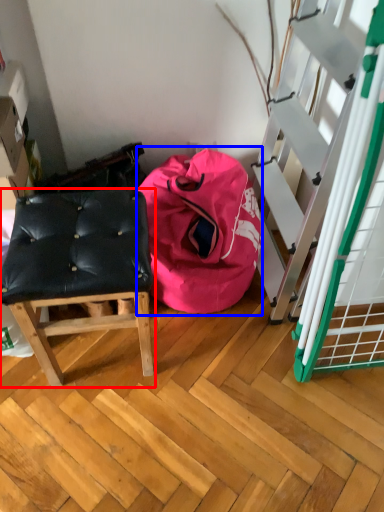
Question: Which object is further to the camera taking this photo, furniture (highlighted by a red box) or bean bag chair (highlighted by a blue box)?

Choices:
 (A) furniture
 (B) bean bag chair

Answer: (B)